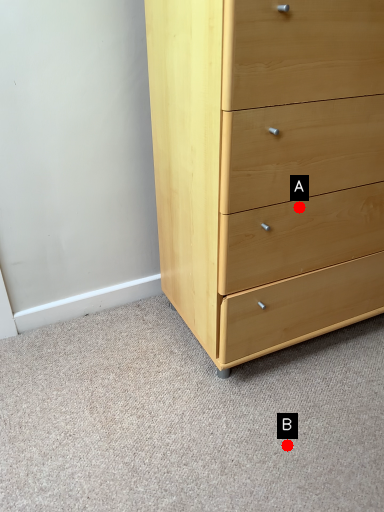
Question: Two points are circled on the image, labeled by A and B beside each circle. Which point is further to the camera?

Choices:
 (A) A is further
 (B) B is further

Answer: (B)